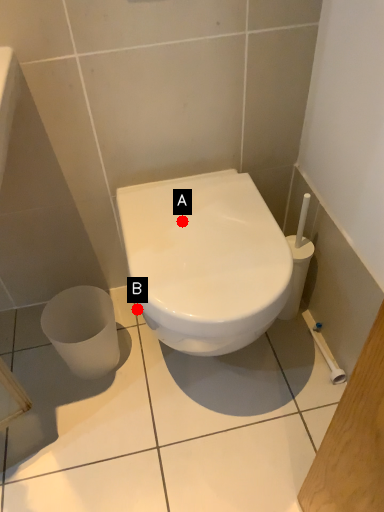
Question: Two points are circled on the image, labeled by A and B beside each circle. Among these points, which one is nearest to the camera?

Choices:
 (A) A is closer
 (B) B is closer

Answer: (A)